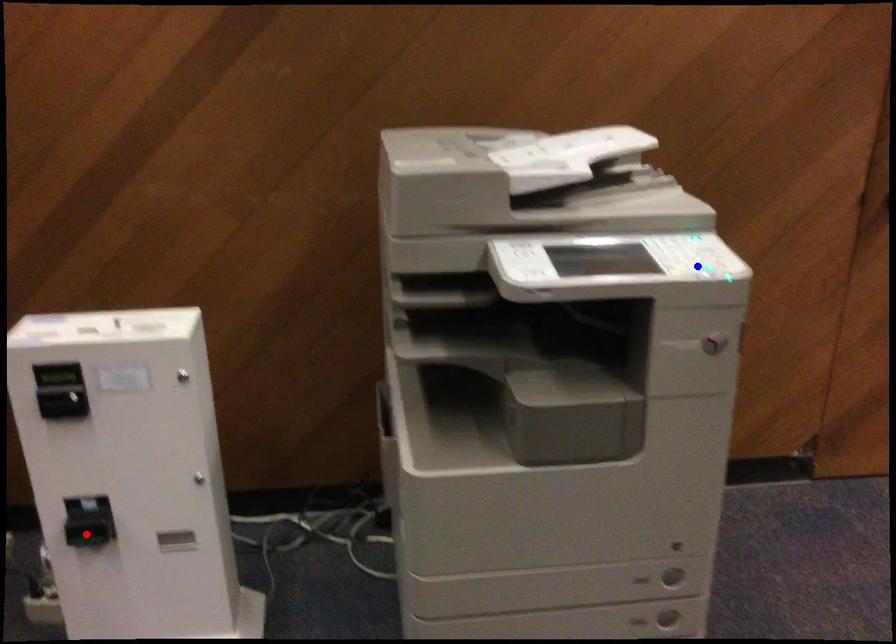
Question: Two points are marked on the image. Which point is closer to the camera?

Choices:
 (A) Blue point is closer.
 (B) Red point is closer.

Answer: (A)